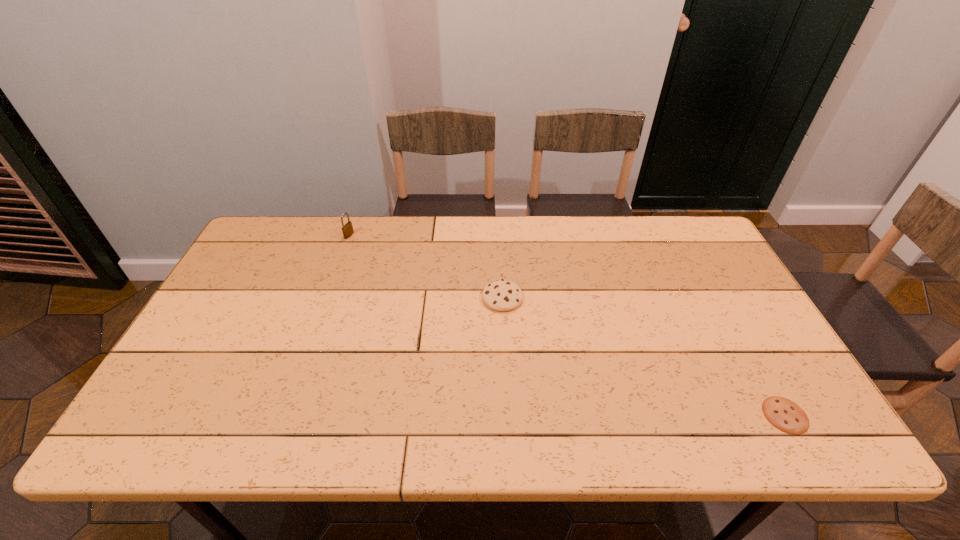
What are the coordinates of `object that is at the near edge` in the screenshot? It's located at (784, 414).

Identify the location of object that is at the right edge. Image resolution: width=960 pixels, height=540 pixels. (784, 414).

Locate an element on the screen. object that is at the near right corner is located at coordinates (784, 414).

Locate an element on the screen. The width and height of the screenshot is (960, 540). free spot at the far edge of the desktop is located at coordinates (323, 255).

The image size is (960, 540). Find the location of `free space at the near edge of the desktop`. free space at the near edge of the desktop is located at coordinates (220, 418).

This screenshot has width=960, height=540. Find the location of `vacant area at the left edge`. vacant area at the left edge is located at coordinates (263, 322).

The width and height of the screenshot is (960, 540). In the image, there is a desktop. What are the coordinates of `vacant area at the right edge` in the screenshot? It's located at (701, 261).

The image size is (960, 540). In the image, there is a desktop. What are the coordinates of `free space at the far left corner` in the screenshot? It's located at (291, 223).

Where is `free space at the far right corner`? The image size is (960, 540). free space at the far right corner is located at coordinates (684, 247).

At what (x,y) coordinates should I click in order to perform the action: click on vacant space that's between the leftmost object and the shortest object. Please return your answer as a coordinate pair (x, y). The height and width of the screenshot is (540, 960). Looking at the image, I should click on (567, 325).